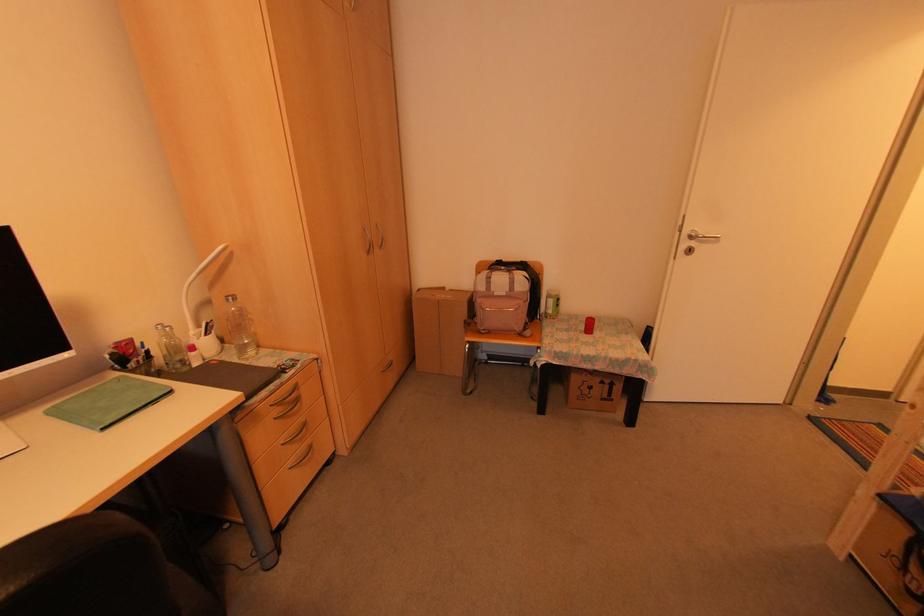
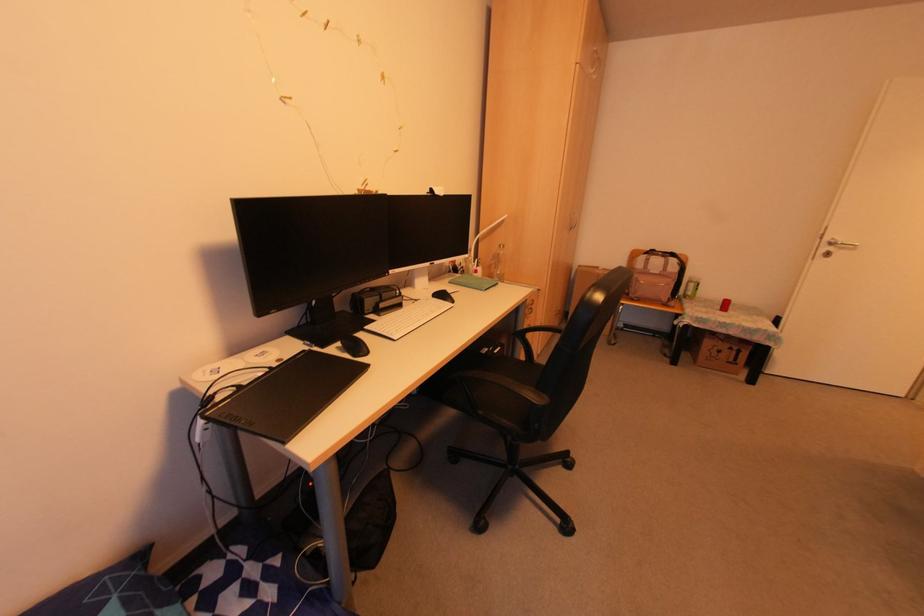
Find the pixel in the second image that matches pixel 588 326 in the first image.

(723, 306)